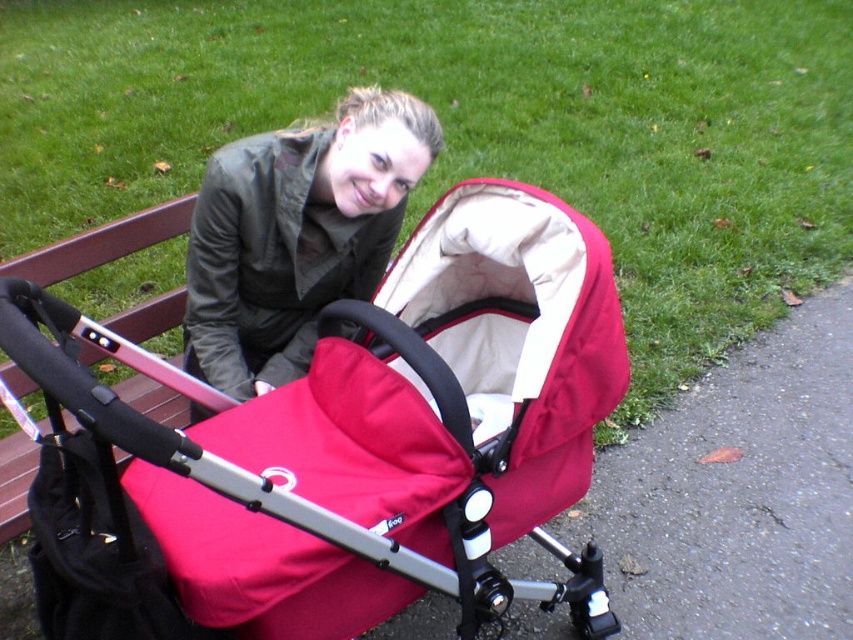
You are a photographer setting up for a portrait. You notice the matte red baby carriage at center and the matte green jacket at center in the scene. Which object should you focus on first if you want to capture the taller subject?

The matte red baby carriage at center is much taller than the matte green jacket at center, so you should focus on the matte red baby carriage at center first.

You are a photographer setting up for a portrait in the park. You have a matte red baby carriage at center and a matte green jacket at center in your frame. If you want to ensure both objects are fully visible without cropping, which object requires more horizontal space in the frame?

The matte red baby carriage at center requires more horizontal space in the frame because its width is larger than the matte green jacket at center.

You are a delivery person who needs to place a small package between the matte red baby carriage at center and the matte green jacket at center. The package is 16 inches long. Can you fit it between them without moving either object?

The distance between the matte red baby carriage at center and the matte green jacket at center is 15.80 inches. Since the package is 16 inches long, it cannot fit between them without moving either object.